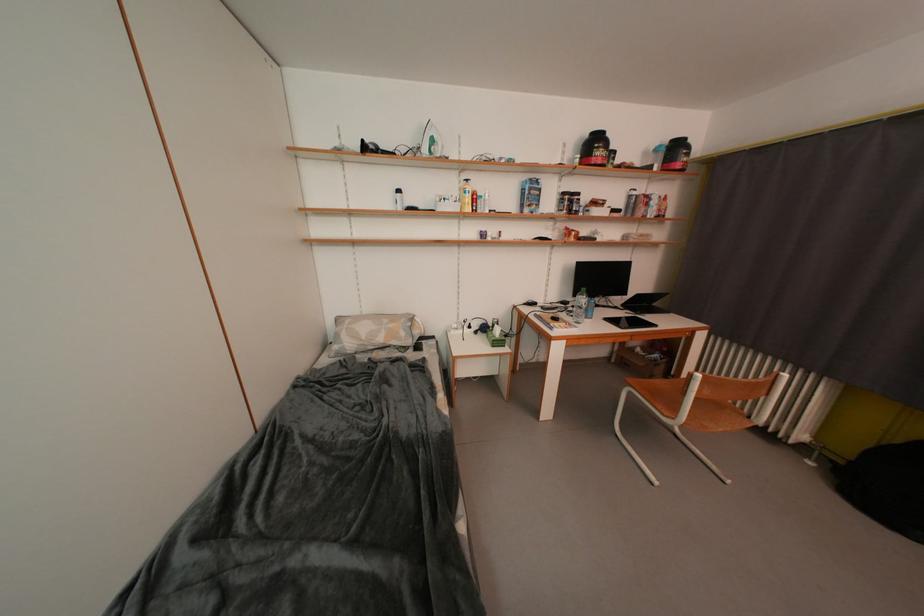
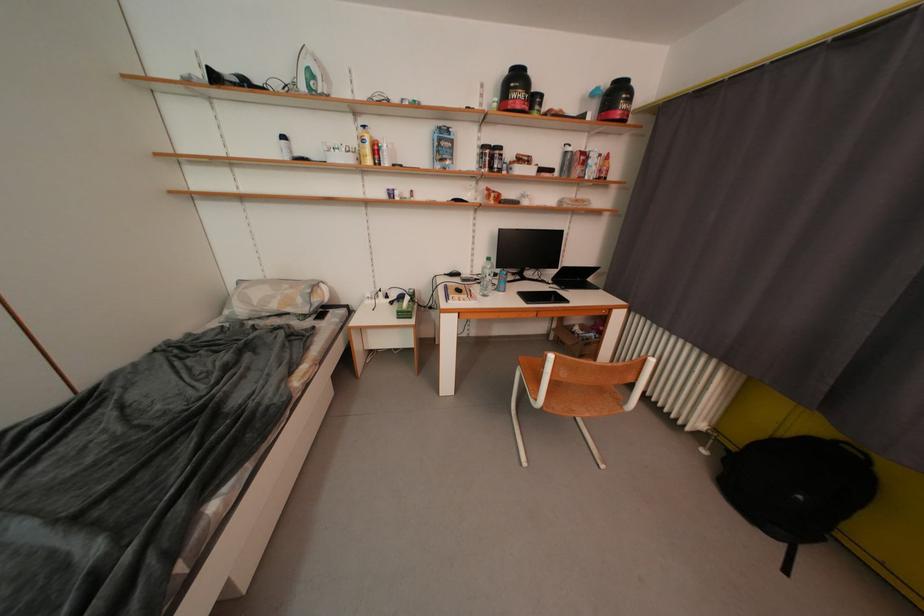
Question: Which direction would the cameraman need to move to produce the second image? Reply with the corresponding letter.

Choices:
 (A) Left
 (B) Right
 (C) Forward
 (D) Backward

Answer: (B)